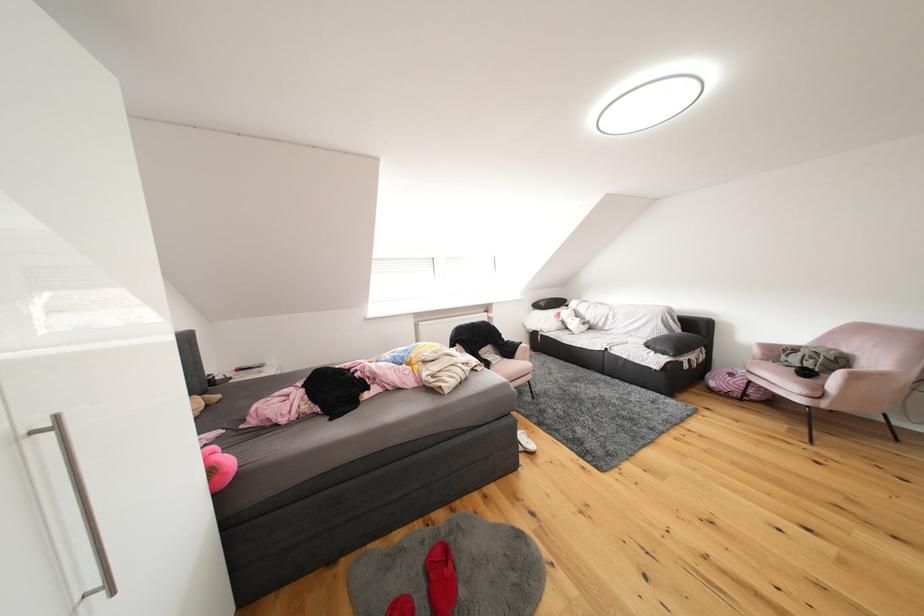
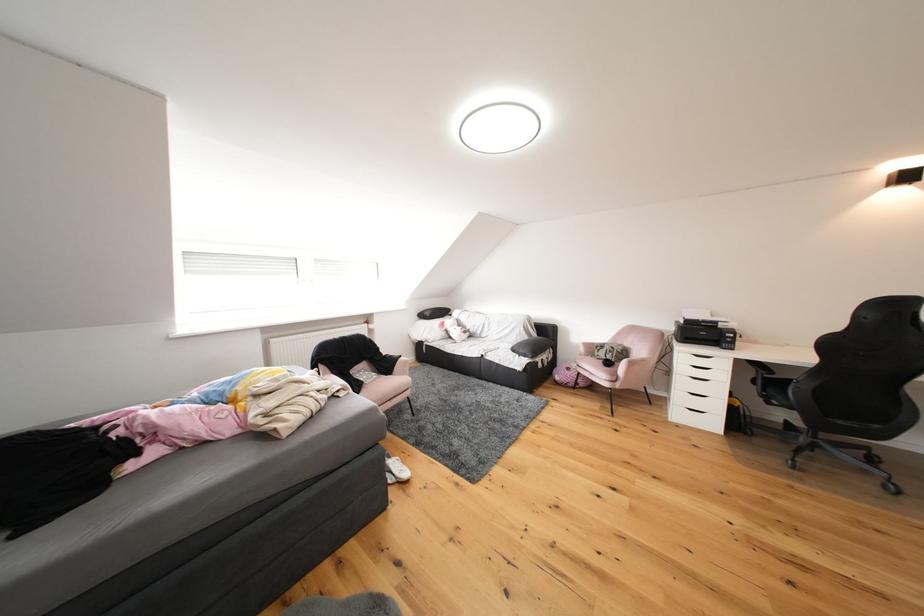
Question: The images are taken continuously from a first-person perspective. In which direction is your viewpoint rotating?

Choices:
 (A) Left
 (B) Right
 (C) Up
 (D) Down

Answer: (B)